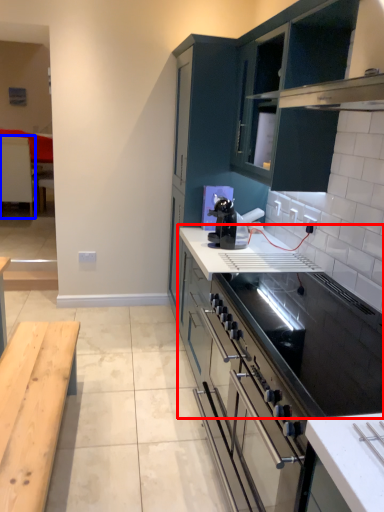
Question: Which point is closer to the camera, countertop (highlighted by a red box) or table (highlighted by a blue box)?

Choices:
 (A) countertop
 (B) table

Answer: (A)